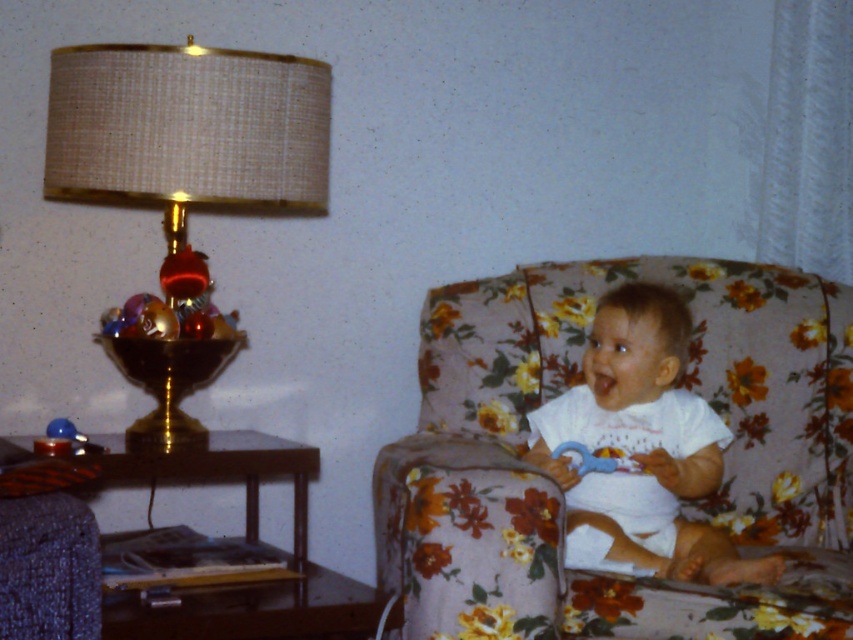
Who is positioned more to the right, floral fabric couch at center or gold metallic lampshade at upper left?

floral fabric couch at center is more to the right.

Which is more to the left, floral fabric couch at center or gold metallic lampshade at upper left?

From the viewer's perspective, gold metallic lampshade at upper left appears more on the left side.

The image size is (853, 640). What do you see at coordinates (560, 493) in the screenshot?
I see `floral fabric couch at center` at bounding box center [560, 493].

Where is `floral fabric couch at center`? The height and width of the screenshot is (640, 853). floral fabric couch at center is located at coordinates (560, 493).

The width and height of the screenshot is (853, 640). Describe the element at coordinates (184, 180) in the screenshot. I see `gold metallic lampshade at upper left` at that location.

Does gold metallic lampshade at upper left have a larger size compared to white cotton baby at center?

Yes, gold metallic lampshade at upper left is bigger than white cotton baby at center.

Which is in front, point (74, 72) or point (643, 428)?

Point (74, 72) is more forward.

Where is `gold metallic lampshade at upper left`? This screenshot has height=640, width=853. gold metallic lampshade at upper left is located at coordinates (184, 180).

Is floral fabric couch at center closer to the viewer compared to white cotton baby at center?

Yes, floral fabric couch at center is in front of white cotton baby at center.

Between floral fabric couch at center and white cotton baby at center, which one appears on the right side from the viewer's perspective?

white cotton baby at center is more to the right.

Is point (526, 307) more distant than point (587, 493)?

Yes, it is behind point (587, 493).

The image size is (853, 640). I want to click on floral fabric couch at center, so click(x=560, y=493).